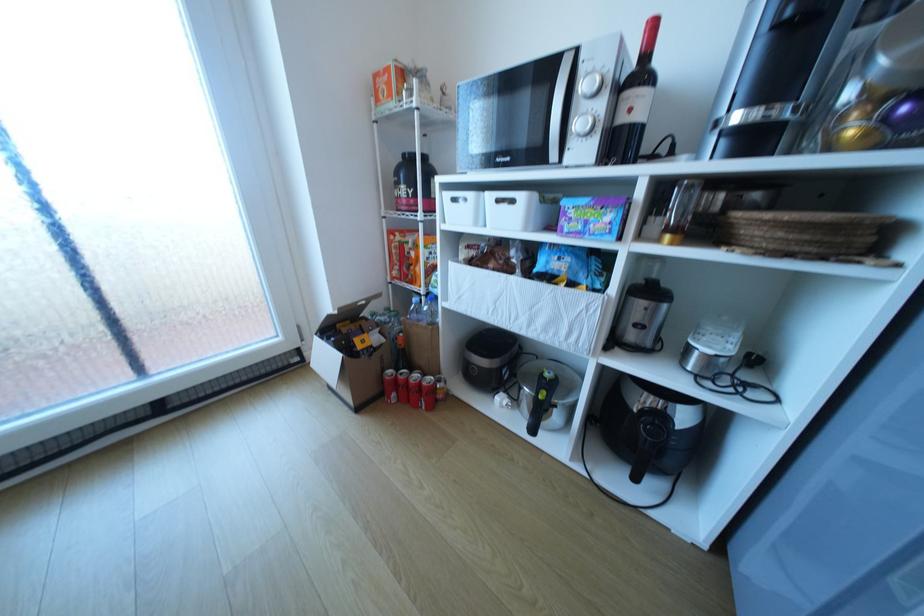
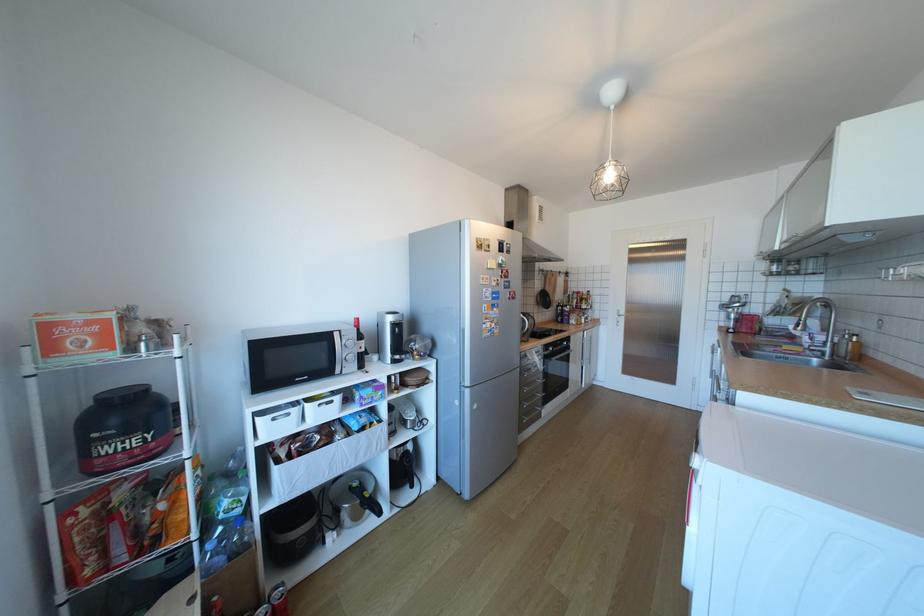
Find the pixel in the second image that matches point 430,382 in the first image.

(283, 607)